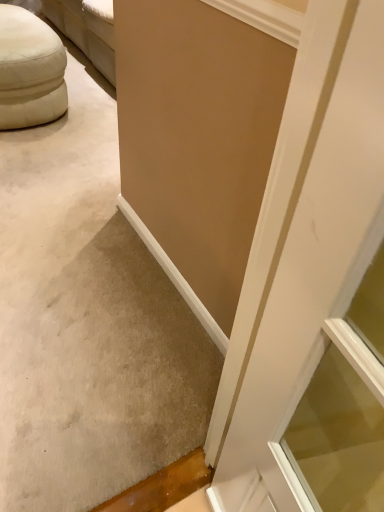
Question: In terms of height, does white fabric ottoman at upper left look taller or shorter compared to beige matte wall at upper center?

Choices:
 (A) short
 (B) tall

Answer: (A)

Question: Considering the positions of white fabric ottoman at upper left and beige matte wall at upper center in the image, is white fabric ottoman at upper left wider or thinner than beige matte wall at upper center?

Choices:
 (A) thin
 (B) wide

Answer: (B)

Question: Is point (44, 54) closer or farther from the camera than point (87, 506)?

Choices:
 (A) closer
 (B) farther

Answer: (B)

Question: Is point (19, 165) closer or farther from the camera than point (34, 33)?

Choices:
 (A) closer
 (B) farther

Answer: (A)

Question: Considering the positions of beige matte wall at upper center and white fabric ottoman at upper left in the image, is beige matte wall at upper center wider or thinner than white fabric ottoman at upper left?

Choices:
 (A) thin
 (B) wide

Answer: (A)

Question: Would you say beige matte wall at upper center is to the left or to the right of white fabric ottoman at upper left in the picture?

Choices:
 (A) left
 (B) right

Answer: (B)

Question: Considering their positions, is beige matte wall at upper center located in front of or behind white fabric ottoman at upper left?

Choices:
 (A) front
 (B) behind

Answer: (A)